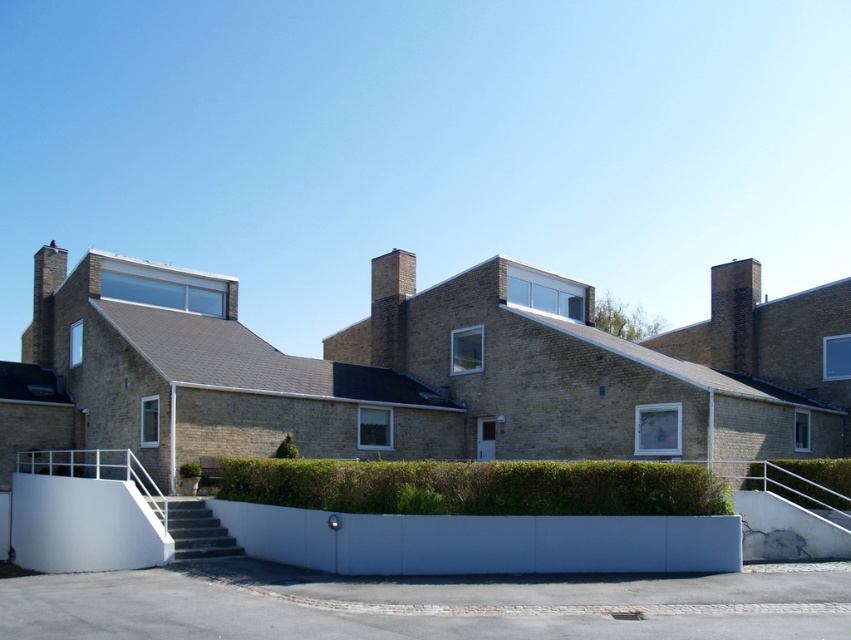
Question: Can you confirm if green leafy hedge at center is smaller than green leafy hedge at lower right?

Choices:
 (A) no
 (B) yes

Answer: (A)

Question: Which point is closer to the camera?

Choices:
 (A) green leafy hedge at lower right
 (B) green leafy hedge at center

Answer: (B)

Question: Can you confirm if green leafy hedge at center is bigger than green leafy hedge at lower right?

Choices:
 (A) no
 (B) yes

Answer: (B)

Question: Does green leafy hedge at center have a larger size compared to green leafy hedge at lower right?

Choices:
 (A) no
 (B) yes

Answer: (B)

Question: Which object is closer to the camera taking this photo?

Choices:
 (A) green leafy hedge at center
 (B) green leafy hedge at lower right

Answer: (A)

Question: Which point is closer to the camera?

Choices:
 (A) (790, 460)
 (B) (244, 492)

Answer: (B)